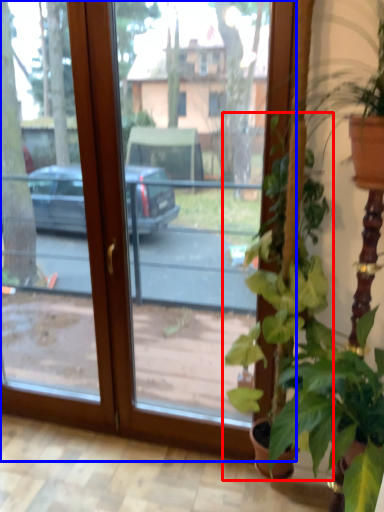
Question: Which of the following is the closest to the observer, houseplant (highlighted by a red box) or window (highlighted by a blue box)?

Choices:
 (A) houseplant
 (B) window

Answer: (A)